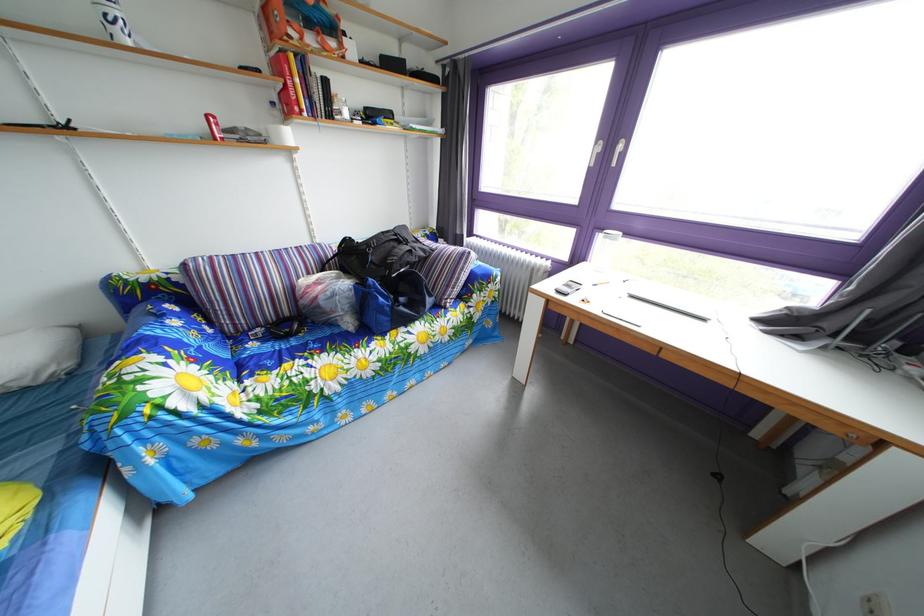
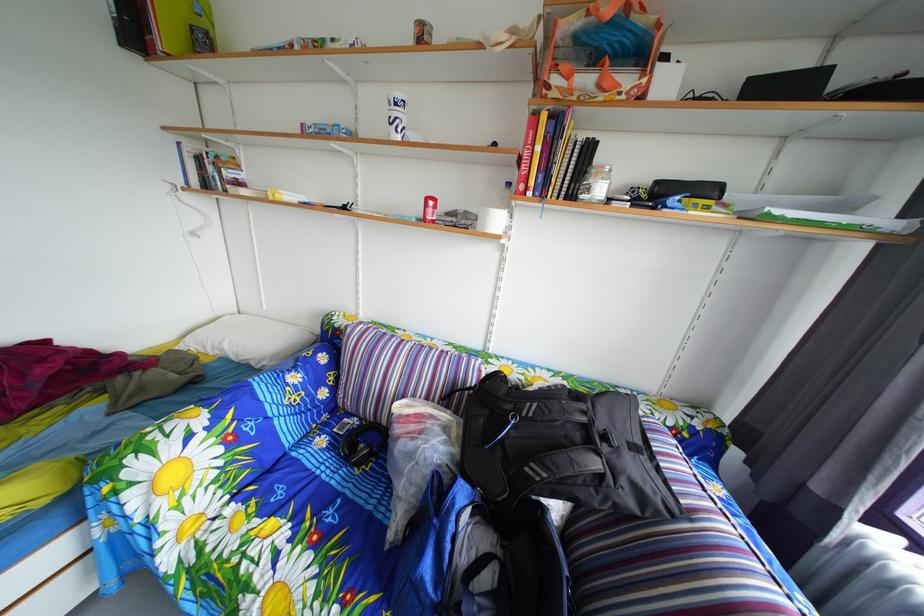
Find the pixel in the second image that matches point (351, 122) in the first image.

(600, 198)